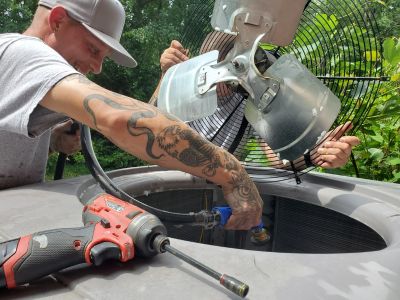
Where is `ventilation fan`? This screenshot has width=400, height=300. ventilation fan is located at coordinates (285, 85).